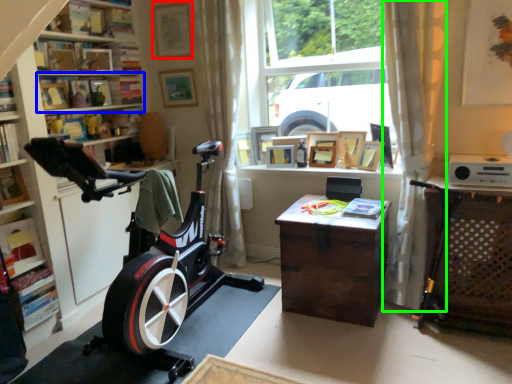
Question: Based on their relative distances, which object is farther from picture frame (highlighted by a red box)? Choose from shelf (highlighted by a blue box) and curtain (highlighted by a green box).

Choices:
 (A) shelf
 (B) curtain

Answer: (B)